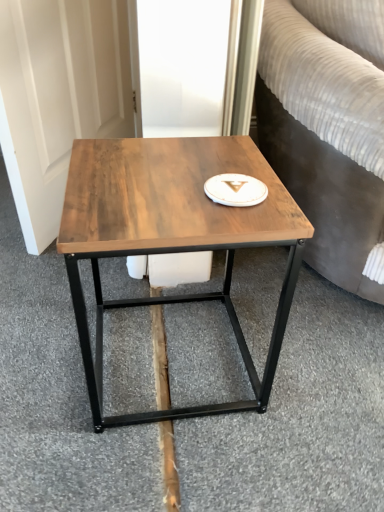
Question: Is brown wood plank at center inside wooden table at center?

Choices:
 (A) yes
 (B) no

Answer: (B)

Question: Is wooden table at center to the left of brown wood plank at center from the viewer's perspective?

Choices:
 (A) yes
 (B) no

Answer: (B)

Question: From a real-world perspective, is wooden table at center located higher than brown wood plank at center?

Choices:
 (A) yes
 (B) no

Answer: (A)

Question: From a real-world perspective, is wooden table at center physically below brown wood plank at center?

Choices:
 (A) yes
 (B) no

Answer: (B)

Question: Is wooden table at center turned away from brown wood plank at center?

Choices:
 (A) yes
 (B) no

Answer: (B)

Question: Does wooden table at center have a smaller size compared to brown wood plank at center?

Choices:
 (A) no
 (B) yes

Answer: (A)

Question: Does brown wood plank at center have a lesser width compared to white glossy platter at center?

Choices:
 (A) yes
 (B) no

Answer: (B)

Question: Considering the relative sizes of brown wood plank at center and white glossy platter at center in the image provided, is brown wood plank at center taller than white glossy platter at center?

Choices:
 (A) no
 (B) yes

Answer: (B)

Question: Are brown wood plank at center and white glossy platter at center located far from each other?

Choices:
 (A) yes
 (B) no

Answer: (B)

Question: Is brown wood plank at center positioned in front of white glossy platter at center?

Choices:
 (A) no
 (B) yes

Answer: (A)

Question: Is brown wood plank at center outside white glossy platter at center?

Choices:
 (A) no
 (B) yes

Answer: (B)

Question: Does brown wood plank at center appear on the right side of white glossy platter at center?

Choices:
 (A) no
 (B) yes

Answer: (A)

Question: Is wooden table at center to the left of white glossy platter at center from the viewer's perspective?

Choices:
 (A) no
 (B) yes

Answer: (B)